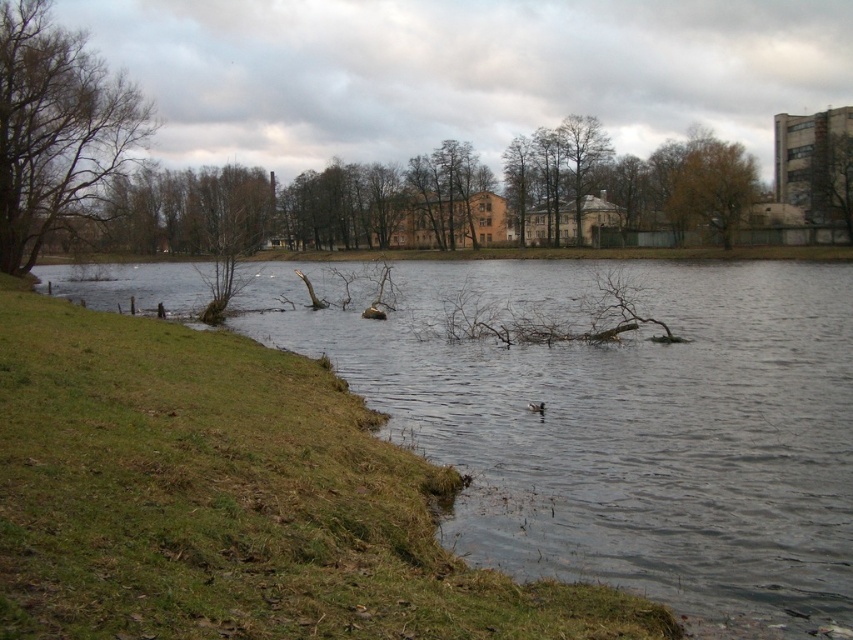
You are an artist planning to paint the lakeside scene. You want to ensure the brown textured tree at upper right and the green leafy tree at upper right are proportionally accurate. Which tree should you make wider in your painting?

The brown textured tree at upper right should be made wider in the painting since its width surpasses that of the green leafy tree at upper right according to the description.

You are an ornithologist observing the serene lakeside scene. You notice two trees at the upper right corner of the image. To determine the best vantage point for observing the bird swimming in the center, you need to know the distance between the two trees. How far apart are the brown textured tree at upper right and the green leafy tree at upper right?

The brown textured tree at upper right and the green leafy tree at upper right are 32.93 feet apart.

You are an observer standing on the lakeside bank. You notice the brown leafless tree at left and the brown matte duck at center. Which object appears bigger in the scene?

The brown leafless tree at left appears bigger than the brown matte duck at center in the scene.